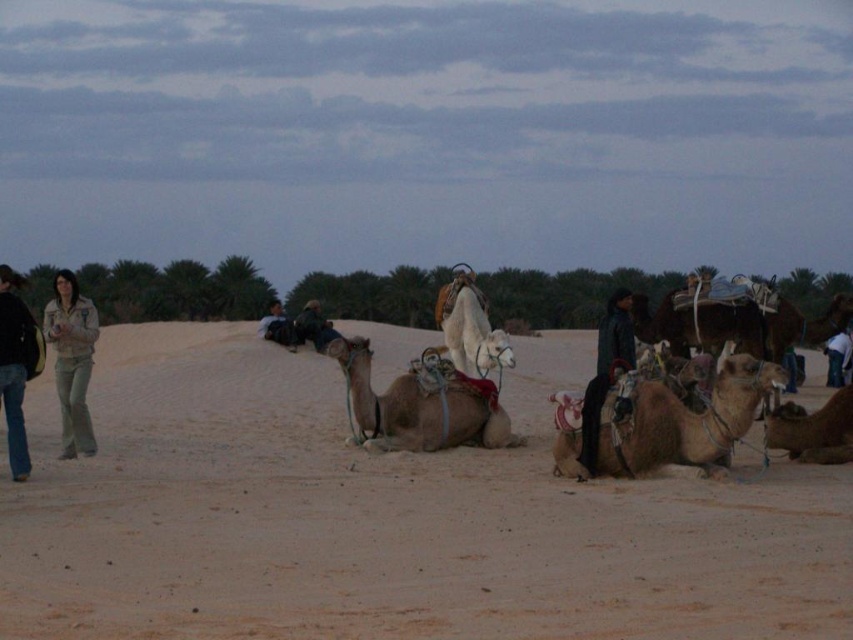
In the scene shown: You are a photographer trying to capture a closeup shot of the light brown leather jacket at center. However, the brown textured camel at center is blocking your view. Can you still take the photo without moving the camel?

The brown textured camel at center is bigger than the light brown leather jacket at center, so it is blocking the jacket. You cannot take the photo without moving the camel.

You are a photographer trying to capture a closeup shot of the light brown leather jacket at center without including the brown textured camel at center in the frame. Given their sizes, is this possible?

The brown textured camel at center is wider than the light brown leather jacket at center, so it might be challenging to frame the jacket without including the camel, especially if they are positioned closely together.